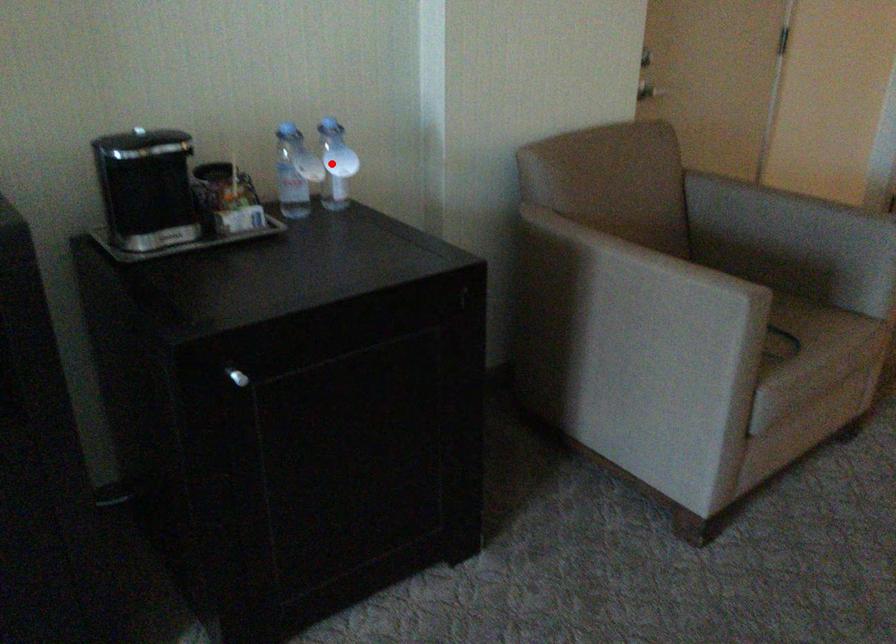
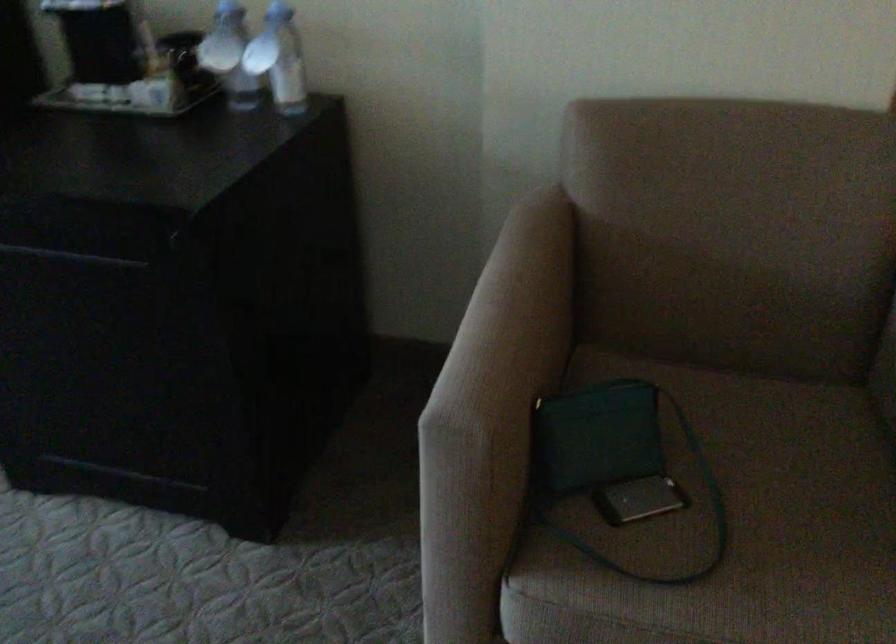
The point at the highlighted location is marked in the first image. Where is the corresponding point in the second image?

(279, 59)